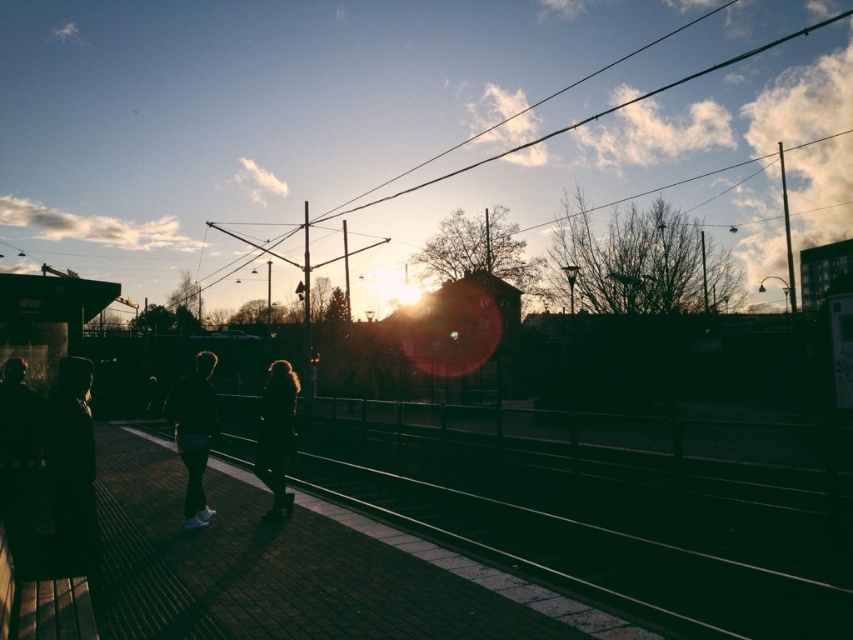
Question: Which of the following is the farthest from the observer?

Choices:
 (A) (28, 474)
 (B) (271, 481)
 (C) (210, 280)
 (D) (67, 536)

Answer: (C)

Question: Where is silhouette jacket at left located in relation to black wire at upper center in the image?

Choices:
 (A) right
 (B) left

Answer: (B)

Question: Does dark clothing at left have a lesser width compared to silhouette hair at center?

Choices:
 (A) yes
 (B) no

Answer: (A)

Question: Which object appears closest to the camera in this image?

Choices:
 (A) dark clothing at left
 (B) silhouette jacket at left
 (C) silhouette hair at center

Answer: (B)

Question: Estimate the real-world distances between objects in this image. Which object is closer to the dark clothing at left?

Choices:
 (A) silhouette hair at center
 (B) black matte jacket at center
 (C) silhouette jacket at left

Answer: (C)

Question: Does black wire at upper center come in front of dark clothing at left?

Choices:
 (A) no
 (B) yes

Answer: (A)